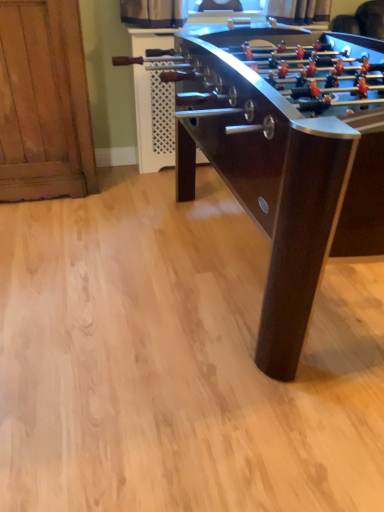
The image size is (384, 512). What do you see at coordinates (284, 155) in the screenshot?
I see `dark brown wood foosball table at center` at bounding box center [284, 155].

The image size is (384, 512). Find the location of `dark brown wood foosball table at center`. dark brown wood foosball table at center is located at coordinates (284, 155).

Looking at this image, in order to face dark brown wood foosball table at center, should I rotate leftwards or rightwards?

Turn right by 13.257 degrees to look at dark brown wood foosball table at center.

I want to click on wooden cabinet at left, so click(x=44, y=103).

Describe the element at coordinates (44, 103) in the screenshot. The width and height of the screenshot is (384, 512). I see `wooden cabinet at left` at that location.

Image resolution: width=384 pixels, height=512 pixels. Find the location of `dark brown wood foosball table at center`. dark brown wood foosball table at center is located at coordinates (284, 155).

Considering the positions of objects wooden cabinet at left and dark brown wood foosball table at center in the image provided, who is more to the right, wooden cabinet at left or dark brown wood foosball table at center?

Positioned to the right is dark brown wood foosball table at center.

Is wooden cabinet at left in front of dark brown wood foosball table at center?

No, it is not.

Between point (58, 24) and point (368, 182), which one is positioned in front?

Positioned in front is point (368, 182).

From the image's perspective, is wooden cabinet at left below dark brown wood foosball table at center?

No, from the image's perspective, wooden cabinet at left is not below dark brown wood foosball table at center.

Consider the image. From a real-world perspective, is wooden cabinet at left positioned above or below dark brown wood foosball table at center?

Clearly, from a real-world perspective, wooden cabinet at left is above dark brown wood foosball table at center.

Based on the photo, can you confirm if wooden cabinet at left is thinner than dark brown wood foosball table at center?

Yes, wooden cabinet at left is thinner than dark brown wood foosball table at center.

Based on the photo, does wooden cabinet at left have a lesser height compared to dark brown wood foosball table at center?

No, wooden cabinet at left is not shorter than dark brown wood foosball table at center.

Can you confirm if wooden cabinet at left is bigger than dark brown wood foosball table at center?

No.

Is wooden cabinet at left completely or partially outside of dark brown wood foosball table at center?

Indeed, wooden cabinet at left is completely outside dark brown wood foosball table at center.

Is wooden cabinet at left directly adjacent to dark brown wood foosball table at center?

No, wooden cabinet at left is not touching dark brown wood foosball table at center.

Is wooden cabinet at left facing towards dark brown wood foosball table at center?

No, wooden cabinet at left is not oriented towards dark brown wood foosball table at center.

What's the angular difference between wooden cabinet at left and dark brown wood foosball table at center's facing directions?

The angle between the facing direction of wooden cabinet at left and the facing direction of dark brown wood foosball table at center is 89.6 degrees.

Measure the distance between wooden cabinet at left and dark brown wood foosball table at center.

wooden cabinet at left and dark brown wood foosball table at center are 33.48 inches apart from each other.

Find the location of `table below the wooden cabinet at left (from a real-world perspective)`. table below the wooden cabinet at left (from a real-world perspective) is located at coordinates (284, 155).

Does dark brown wood foosball table at center appear on the left side of wooden cabinet at left?

No.

Which object is closer to the camera taking this photo, dark brown wood foosball table at center or wooden cabinet at left?

dark brown wood foosball table at center.

Considering the positions of point (195, 169) and point (63, 19), is point (195, 169) closer or farther from the camera than point (63, 19)?

Point (195, 169) appears to be farther away from the viewer than point (63, 19).

From the image's perspective, which is below, dark brown wood foosball table at center or wooden cabinet at left?

dark brown wood foosball table at center, from the image's perspective.

From a real-world perspective, does dark brown wood foosball table at center sit lower than wooden cabinet at left?

Yes, from a real-world perspective, dark brown wood foosball table at center is beneath wooden cabinet at left.

Considering the relative sizes of dark brown wood foosball table at center and wooden cabinet at left in the image provided, is dark brown wood foosball table at center wider than wooden cabinet at left?

Yes.

Who is shorter, dark brown wood foosball table at center or wooden cabinet at left?

dark brown wood foosball table at center.

In terms of size, does dark brown wood foosball table at center appear bigger or smaller than wooden cabinet at left?

dark brown wood foosball table at center is bigger than wooden cabinet at left.

Looking at this image, is wooden cabinet at left located within dark brown wood foosball table at center?

No, wooden cabinet at left is located outside of dark brown wood foosball table at center.

Are dark brown wood foosball table at center and wooden cabinet at left beside each other?

No, dark brown wood foosball table at center is not touching wooden cabinet at left.

Is dark brown wood foosball table at center oriented away from wooden cabinet at left?

dark brown wood foosball table at center is not turned away from wooden cabinet at left.

Measure the distance from dark brown wood foosball table at center to wooden cabinet at left.

dark brown wood foosball table at center and wooden cabinet at left are 33.48 inches apart.

At what (x,y) coordinates should I click in order to perform the action: click on furniture that appears above the dark brown wood foosball table at center (from a real-world perspective). Please return your answer as a coordinate pair (x, y). The height and width of the screenshot is (512, 384). Looking at the image, I should click on tap(44, 103).

Where is `furniture above the dark brown wood foosball table at center (from the image's perspective)`? furniture above the dark brown wood foosball table at center (from the image's perspective) is located at coordinates (44, 103).

Image resolution: width=384 pixels, height=512 pixels. Find the location of `furniture on the left side of dark brown wood foosball table at center`. furniture on the left side of dark brown wood foosball table at center is located at coordinates (44, 103).